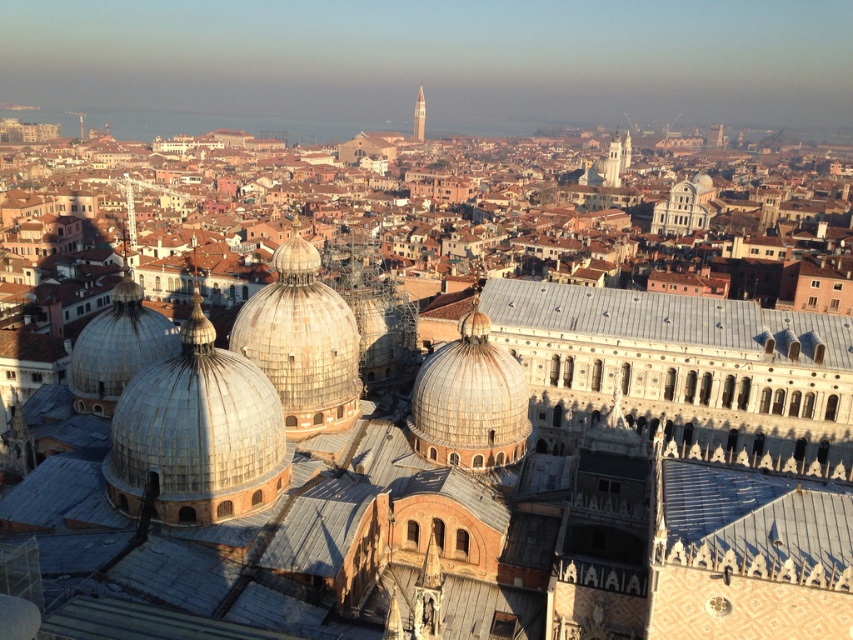
Consider the image. You are standing in Venice and want to determine the relative positions of two points in the scene. Which point is closer to you, point (326, 317) or point (421, 132)?

Point (326, 317) is closer to the viewer than point (421, 132).

Consider the image. You are standing in Venice, Italy, and want to know how far you are from the point marked at coordinates [325,342] in the image. Can you determine the distance?

The point at coordinates [325,342] is 103.99 meters away from the viewer.

You are an architect analyzing the architectural features of Venice. You observe the silver metallic dome at center and the matte silver dome at center. Which dome has a larger size?

The silver metallic dome at center is bigger than the matte silver dome at center, so the silver metallic dome at center has a larger size.